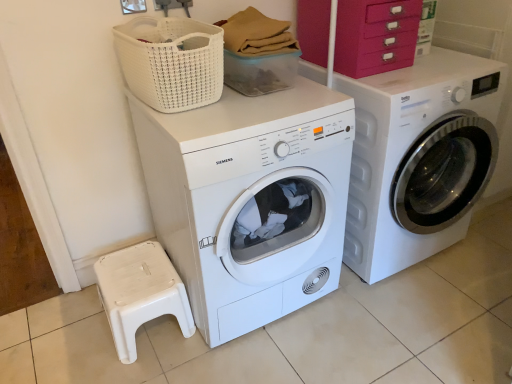
Find the location of a particular element. This screenshot has height=384, width=512. vacant area that is situated to the right of white woven basket at upper center is located at coordinates (277, 106).